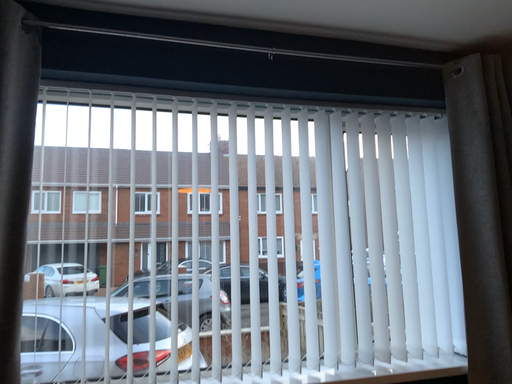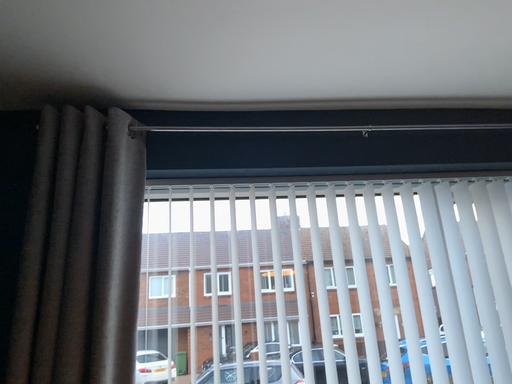
Question: Which way did the camera rotate in the video?

Choices:
 (A) rotated upward
 (B) rotated downward

Answer: (A)